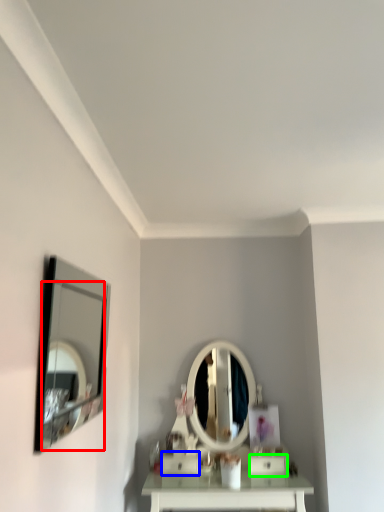
Question: Based on their relative distances, which object is nearer to mirror (highlighted by a red box)? Choose from drawer (highlighted by a blue box) and drawer (highlighted by a green box).

Choices:
 (A) drawer
 (B) drawer

Answer: (A)